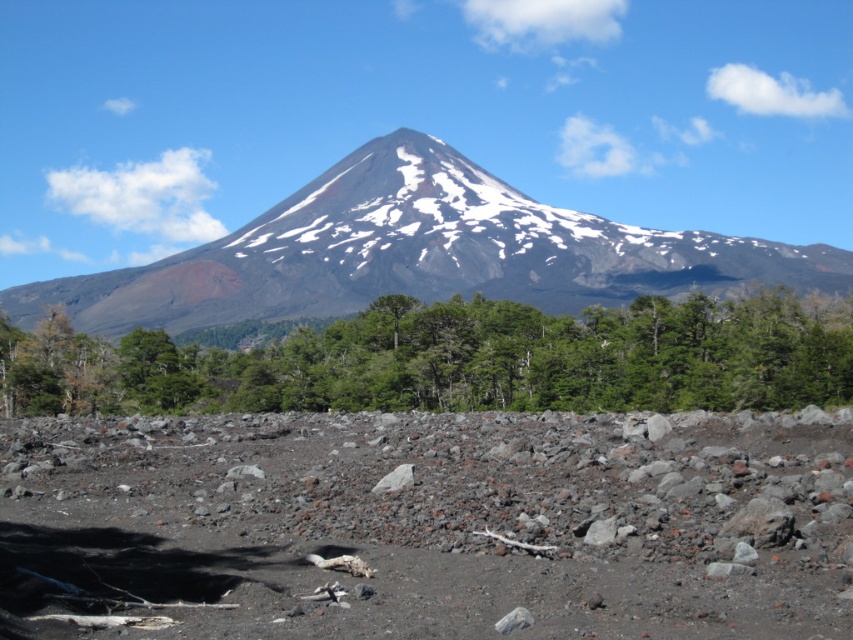
Which is in front, point (840, 396) or point (746, 260)?

Positioned in front is point (840, 396).

Is point (503, 342) closer to camera compared to point (32, 316)?

Yes, it is in front of point (32, 316).

This screenshot has height=640, width=853. I want to click on green leafy trees at center, so 459,358.